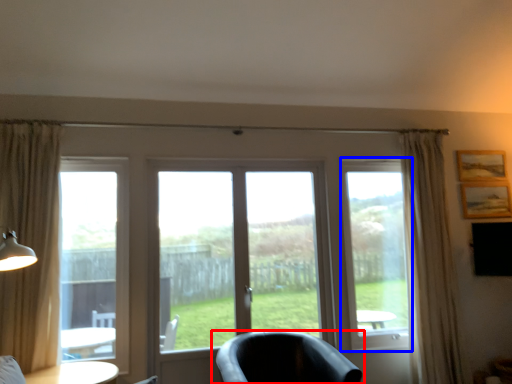
Question: Which object appears farthest to the camera in this image, chair (highlighted by a red box) or window screen (highlighted by a blue box)?

Choices:
 (A) chair
 (B) window screen

Answer: (B)